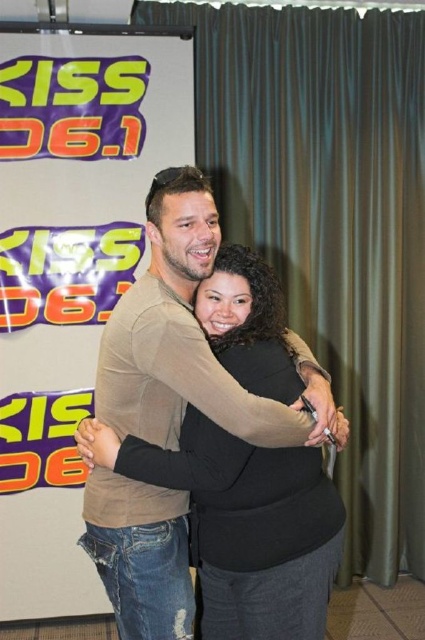
You are a photographer setting up for an event. You need to position a camera so that both the matte green curtain at center and the matte white banner at upper left are in frame. Which object should you ensure is closer to the camera to include both in the shot?

The matte green curtain at center is wider than the matte white banner at upper left. To include both in the frame, position the camera so the wider matte green curtain at center is closer, allowing its greater width to fit while the narrower banner remains in view.